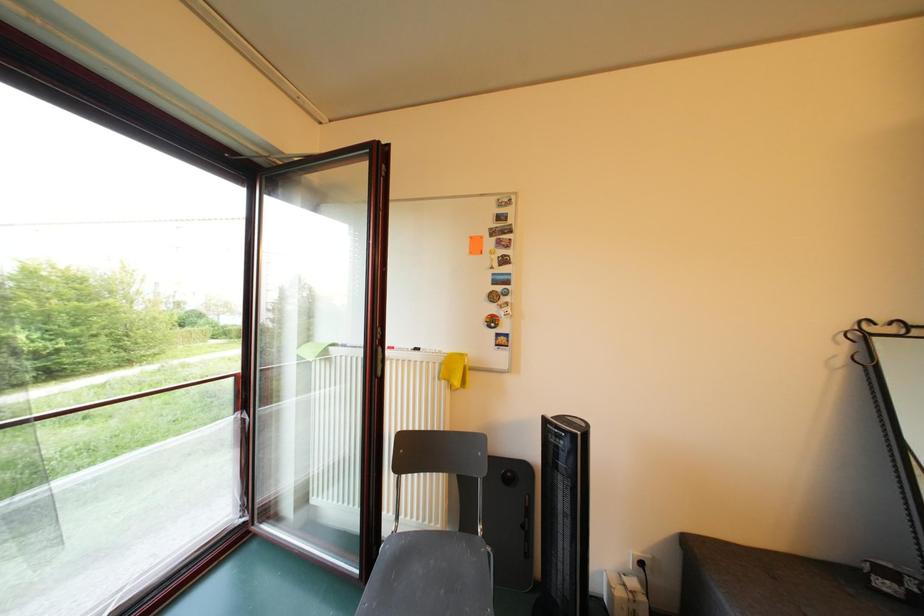
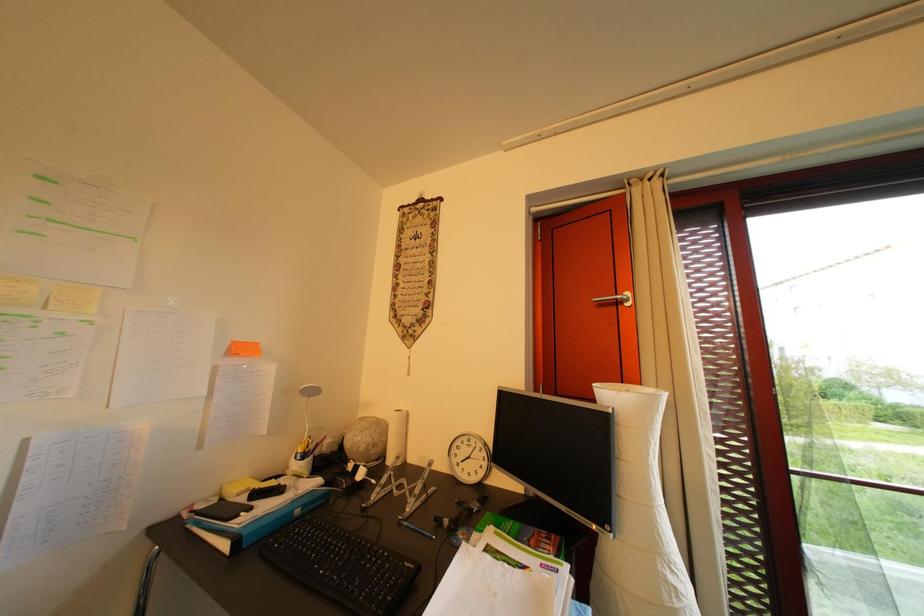
Question: The camera is either moving clockwise (left) or counter-clockwise (right) around the object. The first image is from the beginning of the video and the second image is from the end. Is the camera moving left or right when shooting the video?

Choices:
 (A) Left
 (B) Right

Answer: (B)